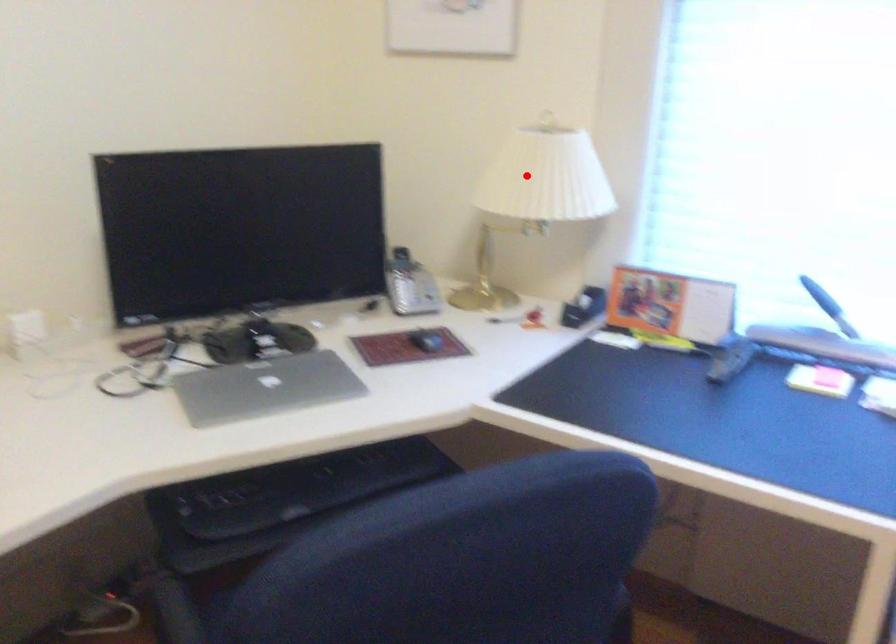
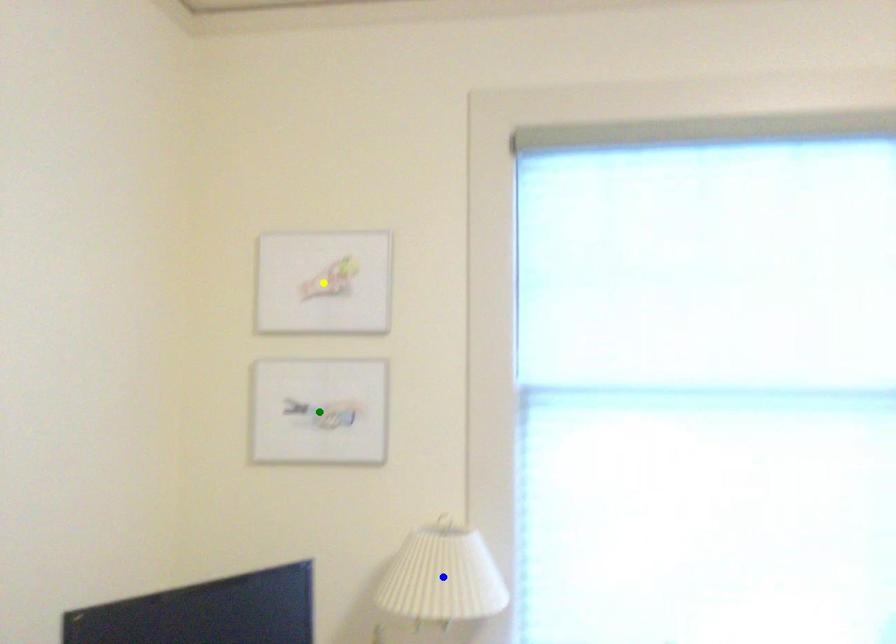
Question: I am providing you with two images of the same scene from different viewpoints. A red point is marked on the first image. You are given multiple points on the second image. Which spot in image 2 lines up with the point in image 1?

Choices:
 (A) yellow point
 (B) blue point
 (C) green point

Answer: (B)